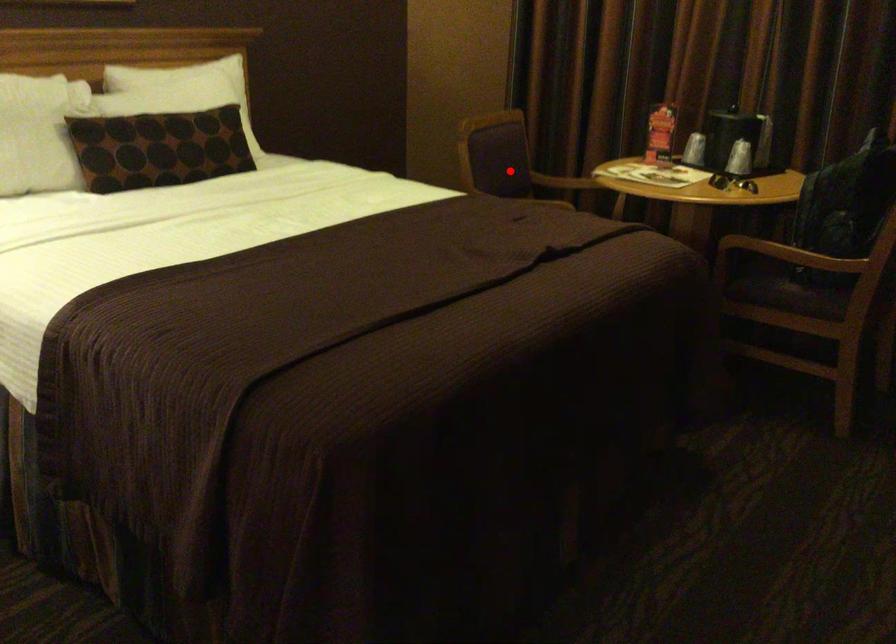
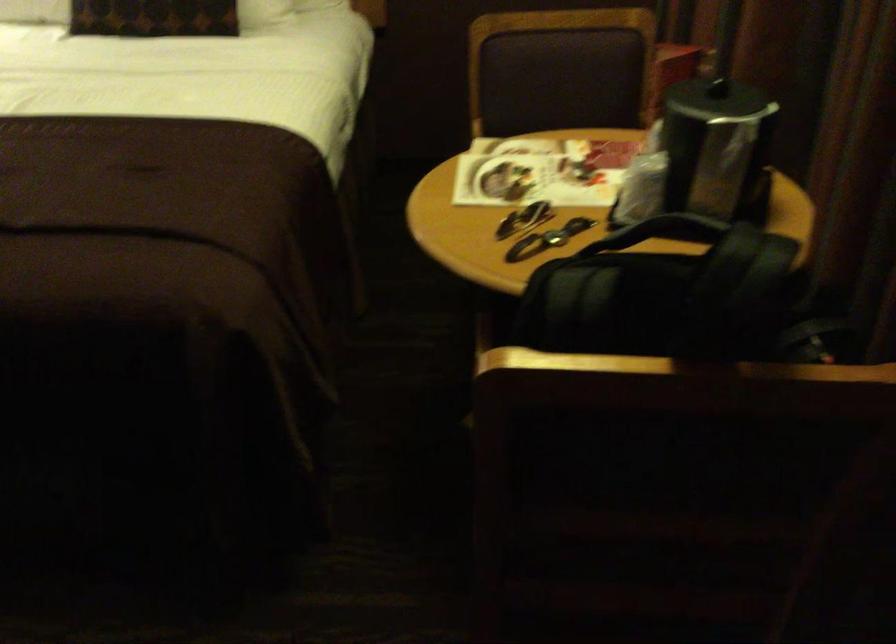
Where in the second image is the point corresponding to the highlighted location from the first image?

(553, 113)